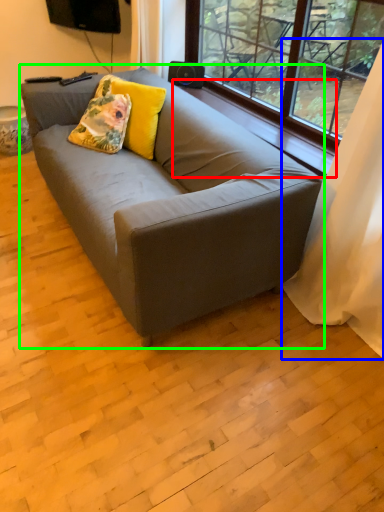
Question: Which object is the farthest from window sill (highlighted by a red box)? Choose among these: curtain (highlighted by a blue box) or studio couch (highlighted by a green box).

Choices:
 (A) curtain
 (B) studio couch

Answer: (B)